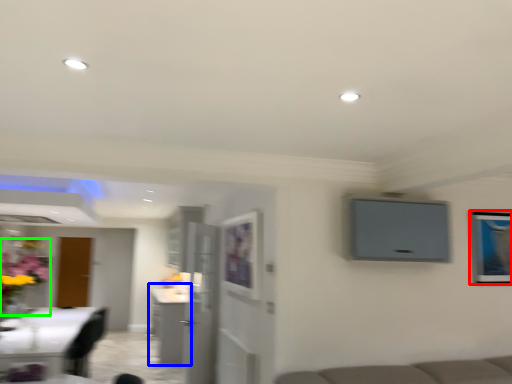
Question: Considering the real-world distances, which object is closest to picture frame (highlighted by a red box)? cabinetry (highlighted by a blue box) or floral arrangement (highlighted by a green box).

Choices:
 (A) cabinetry
 (B) floral arrangement

Answer: (A)